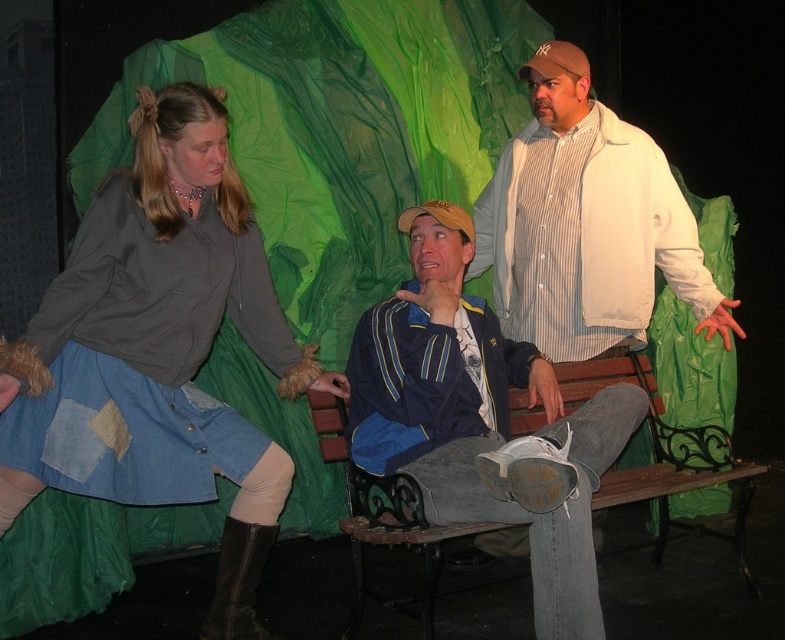
Question: Is denim skirt at left to the right of blue fabric jacket at center from the viewer's perspective?

Choices:
 (A) no
 (B) yes

Answer: (A)

Question: Does blue fabric jacket at center lie behind brown suede boot at lower left?

Choices:
 (A) no
 (B) yes

Answer: (A)

Question: Which point is farther from the camera taking this photo?

Choices:
 (A) (334, 458)
 (B) (411, 444)

Answer: (A)

Question: Does blue fabric jacket at center have a greater width compared to white striped shirt at upper center?

Choices:
 (A) yes
 (B) no

Answer: (B)

Question: Estimate the real-world distances between objects in this image. Which object is farther from the wooden bench at center?

Choices:
 (A) white striped shirt at upper center
 (B) blue fabric jacket at center
 (C) denim skirt at left

Answer: (C)

Question: Estimate the real-world distances between objects in this image. Which object is farther from the blue fabric jacket at center?

Choices:
 (A) white striped shirt at upper center
 (B) denim skirt at left
 (C) brown suede boot at lower left

Answer: (C)